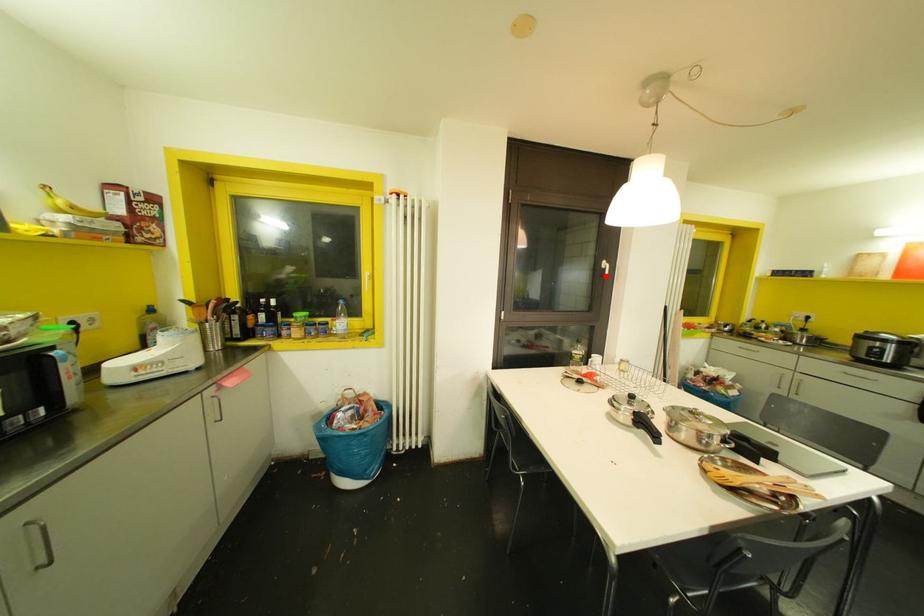
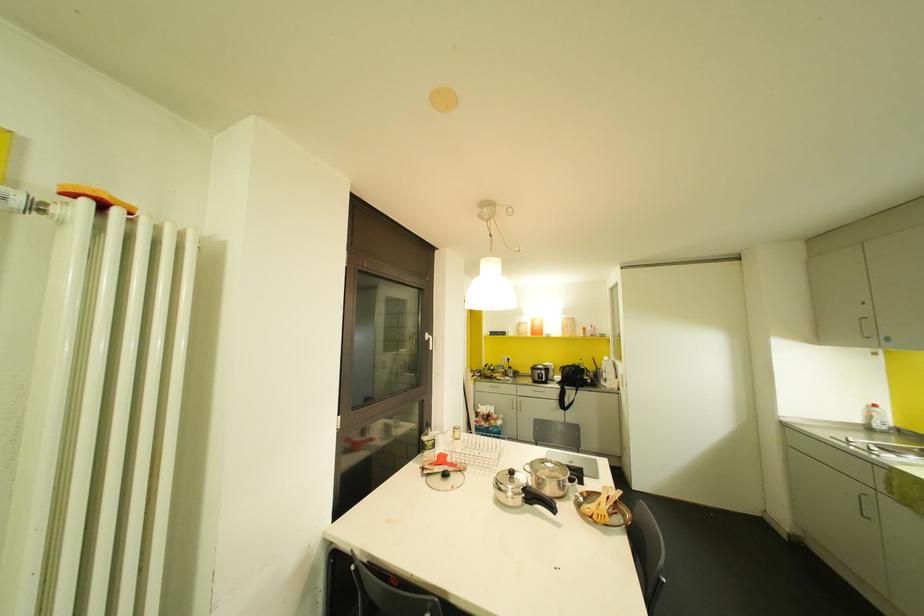
Question: I am providing you with two images of the same scene from different viewpoints. A red point is marked on the first image. At the location where the point appears in image 1, is it still visible in image 2?

Choices:
 (A) Yes
 (B) No

Answer: (A)